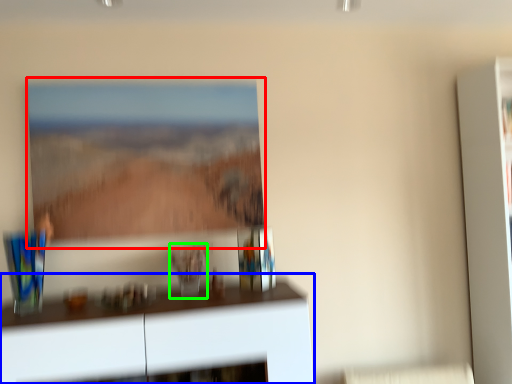
Question: Which object is positioned closest to picture frame (highlighted by a red box)? Select from furniture (highlighted by a blue box) and glass vase (highlighted by a green box).

Choices:
 (A) furniture
 (B) glass vase

Answer: (B)